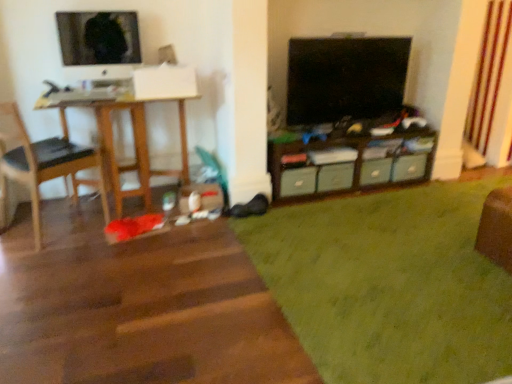
Question: Is the surface of black glossy tv at upper center, which is counted as the second television, starting from the left, in direct contact with green shag rug at lower right?

Choices:
 (A) no
 (B) yes

Answer: (A)

Question: Does black glossy tv at upper center, which is counted as the second television, starting from the left, have a lesser height compared to green shag rug at lower right?

Choices:
 (A) no
 (B) yes

Answer: (A)

Question: From a real-world perspective, is black glossy tv at upper center, which is counted as the second television, starting from the left, below green shag rug at lower right?

Choices:
 (A) no
 (B) yes

Answer: (A)

Question: Is black glossy tv at upper center, which is counted as the first television, starting from the right, further to the viewer compared to green shag rug at lower right?

Choices:
 (A) yes
 (B) no

Answer: (A)

Question: Can you confirm if black glossy tv at upper center, which is counted as the second television, starting from the left, is bigger than green shag rug at lower right?

Choices:
 (A) yes
 (B) no

Answer: (B)

Question: Can you confirm if black glossy tv at upper center, which is counted as the first television, starting from the right, is positioned to the left of green shag rug at lower right?

Choices:
 (A) no
 (B) yes

Answer: (B)

Question: Is black leather chair at left at the back of matte plastic drawer at center, which is the 1th drawer in right-to-left order?

Choices:
 (A) no
 (B) yes

Answer: (A)

Question: Considering the relative sizes of matte plastic drawer at center, marked as the 4th drawer in a left-to-right arrangement, and black leather chair at left in the image provided, is matte plastic drawer at center, marked as the 4th drawer in a left-to-right arrangement, shorter than black leather chair at left?

Choices:
 (A) yes
 (B) no

Answer: (A)

Question: Is matte plastic drawer at center, which is the 1th drawer in right-to-left order, positioned before black leather chair at left?

Choices:
 (A) yes
 (B) no

Answer: (B)

Question: Does matte plastic drawer at center, which is the 1th drawer in right-to-left order, appear on the right side of black leather chair at left?

Choices:
 (A) yes
 (B) no

Answer: (A)

Question: Is matte plastic drawer at center, which is the 1th drawer in right-to-left order, with black leather chair at left?

Choices:
 (A) no
 (B) yes

Answer: (A)

Question: From a real-world perspective, is matte plastic drawer at center, marked as the 4th drawer in a left-to-right arrangement, below black leather chair at left?

Choices:
 (A) yes
 (B) no

Answer: (A)

Question: Can we say green shag rug at lower right lies outside wooden cabinet at center?

Choices:
 (A) yes
 (B) no

Answer: (A)